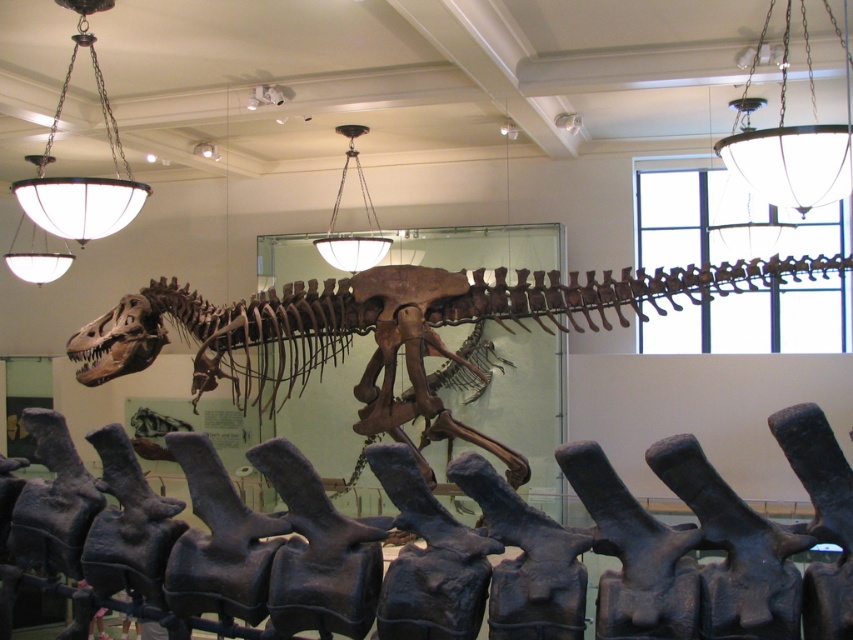
You are a museum visitor holding a measuring tape. You want to know if the brown bone at center can fit through a narrow opening that is exactly the width of the white glass chandelier at upper left. Can it?

The brown bone at center is wider than the white glass chandelier at upper left, so it cannot fit through an opening that is the same width as the chandelier.

You are standing in the museum and want to take a photo of both the dinosaur skeleton and the artifacts in the foreground. Which point, point (107, 1) or point (360, 180), is closer to you when focusing your camera?

Point (107, 1) is closer to the viewer than point (360, 180), so you should focus on that point first to ensure both elements are in clear view.

You are standing in the museum and see two points marked in the image. Which point is closer to you, point (576,592) or point (512,321)?

Point (576,592) is closer to the viewer than point (512,321).